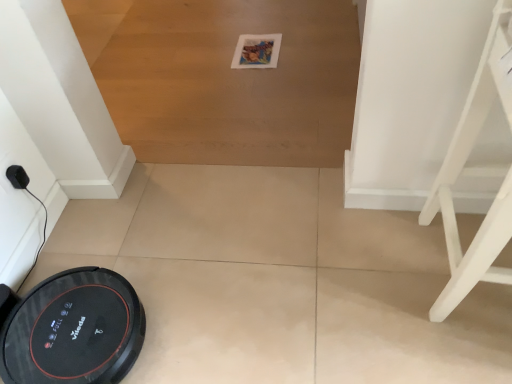
This screenshot has height=384, width=512. Find the location of `free space to the left of white wood chair at right`. free space to the left of white wood chair at right is located at coordinates (353, 286).